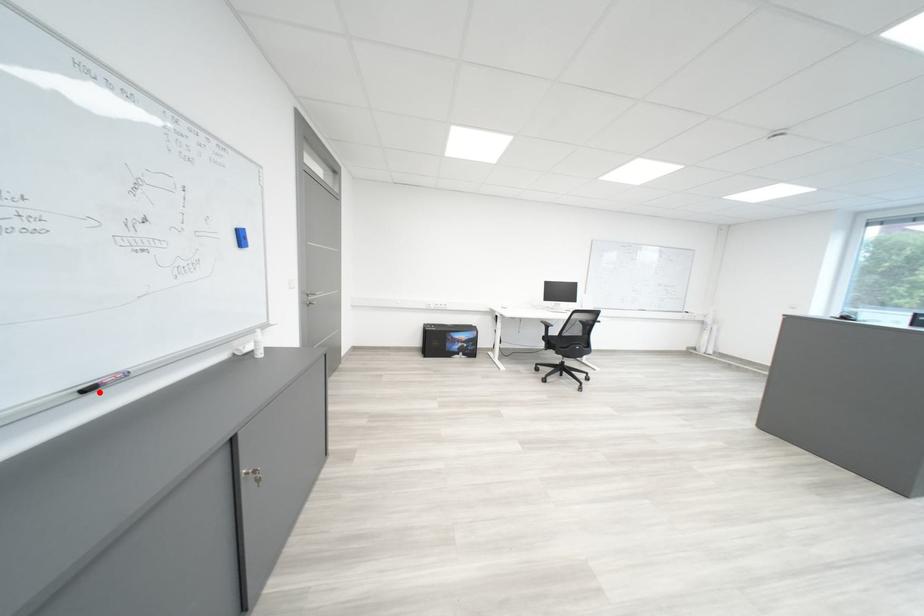
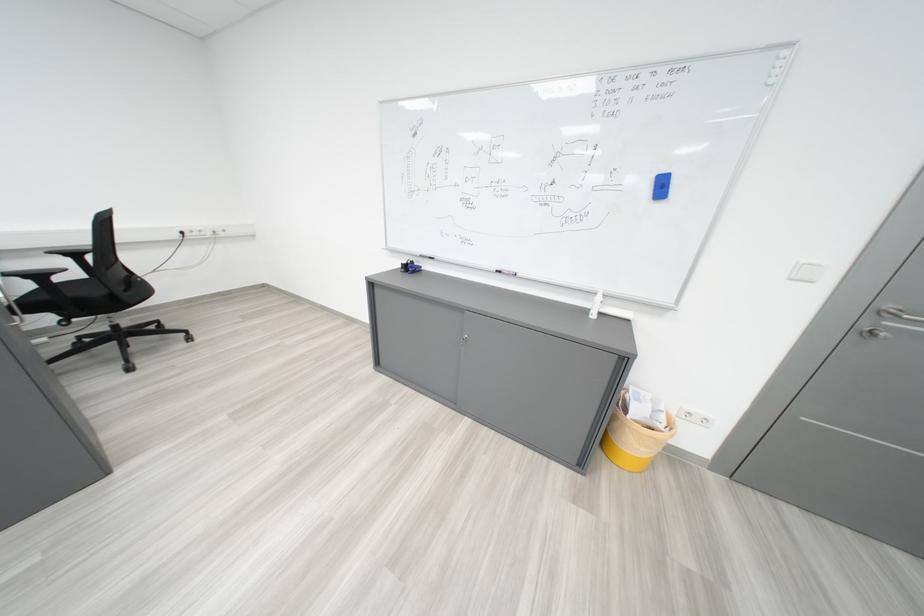
Where in the second image is the point corresponding to the highlighted location from the first image?

(511, 273)